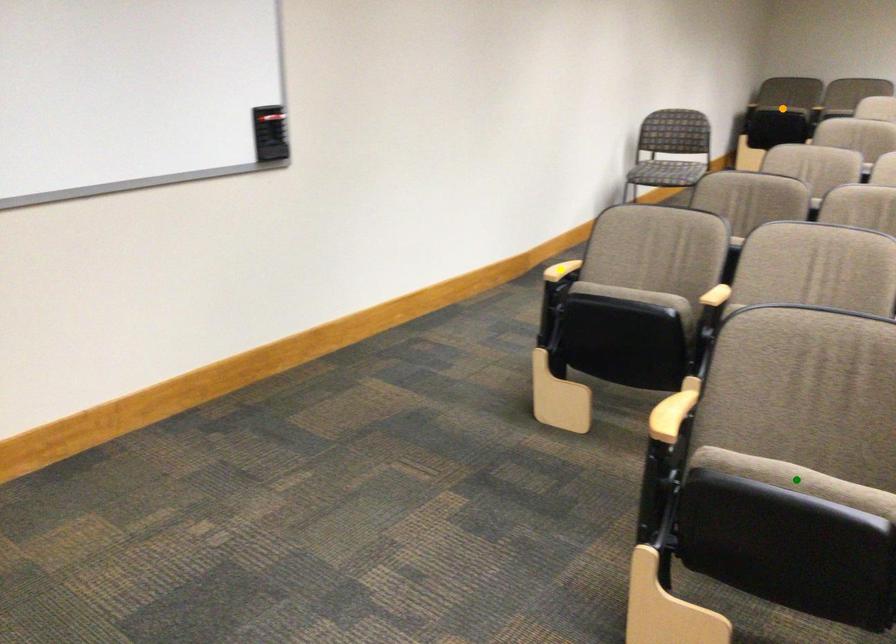
Order these from nearest to farthest:
orange point, green point, yellow point

orange point
yellow point
green point